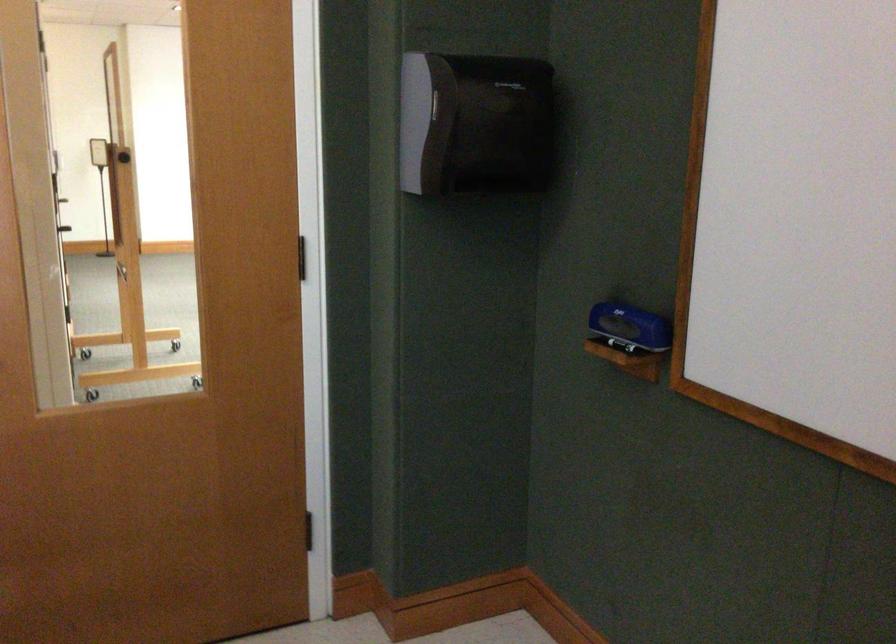
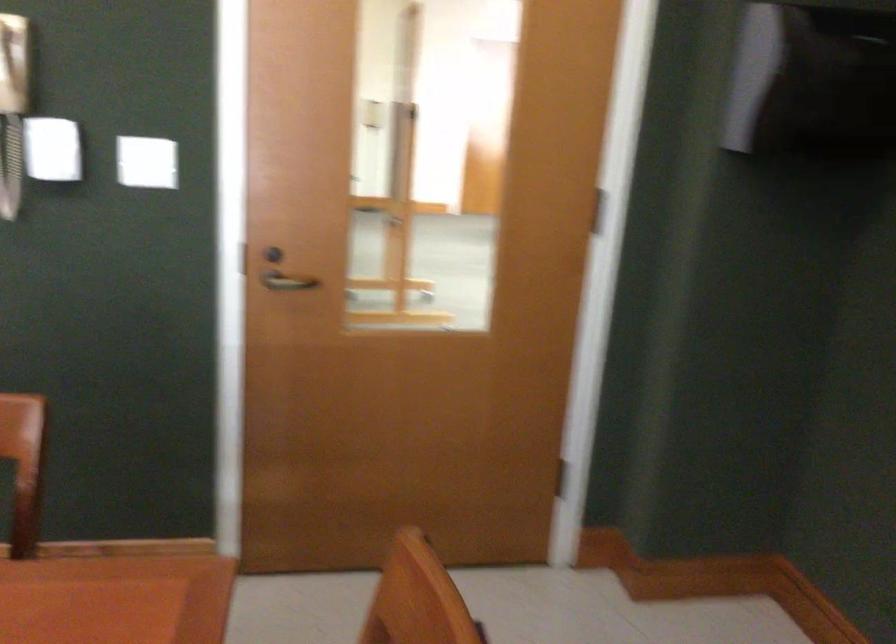
Question: The images are taken continuously from a first-person perspective. In which direction are you moving?

Choices:
 (A) Left
 (B) Right
 (C) Forward
 (D) Backward

Answer: (A)